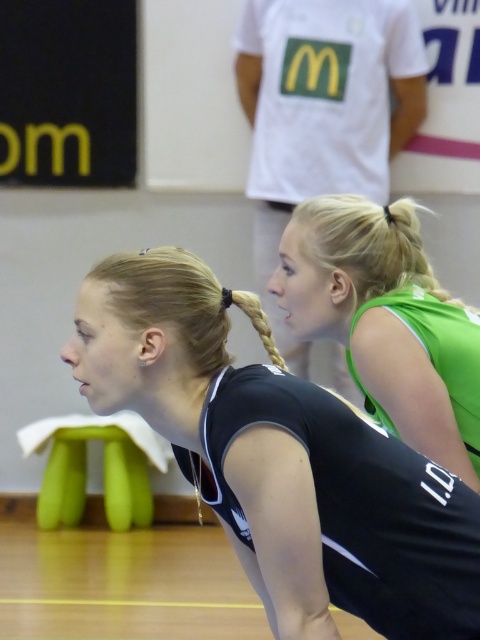
Question: Can you confirm if green jersey at upper center is bigger than green jersey at upper right?

Choices:
 (A) yes
 (B) no

Answer: (A)

Question: Is black matte uniform at center below green jersey at upper center?

Choices:
 (A) no
 (B) yes

Answer: (B)

Question: Does black matte uniform at center have a greater width compared to green jersey at upper center?

Choices:
 (A) yes
 (B) no

Answer: (B)

Question: Which of the following is the closest to the observer?

Choices:
 (A) green jersey at upper right
 (B) black matte uniform at center

Answer: (B)

Question: Which is farther from the black matte uniform at center?

Choices:
 (A) green jersey at upper center
 (B) green jersey at upper right

Answer: (A)

Question: Which point is closer to the camera taking this photo?

Choices:
 (A) (309, 122)
 (B) (160, 420)

Answer: (B)